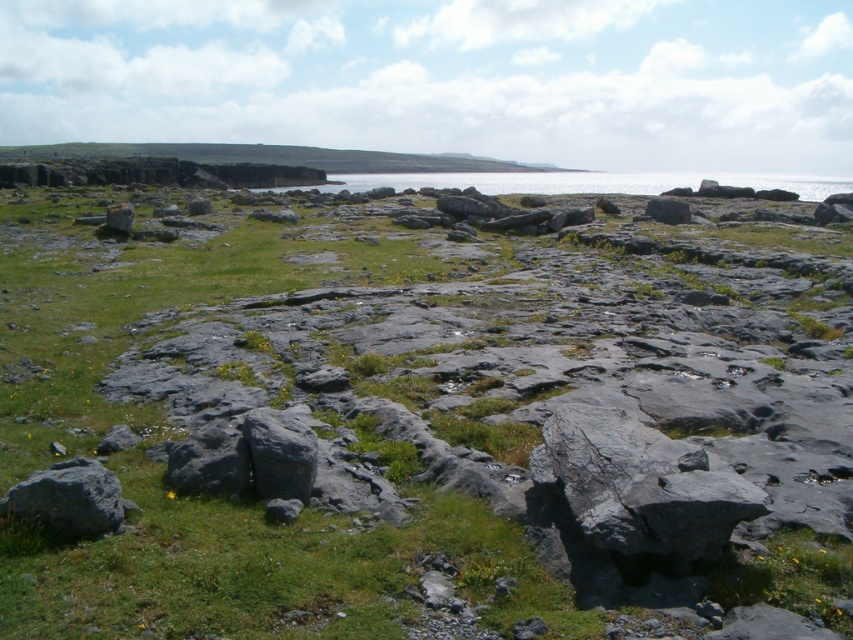
You are a drone operator trying to capture a photo of the green grassy hillside at upper center. The drone is currently at the origin point of the scene. What are the coordinates you should input to move the drone to the correct location?

The coordinates to move the drone to the green grassy hillside at upper center are point [277,156].

You are standing at the edge of the coastal landscape and want to place a small flag between the gray rough rock at lower left and the gray rough rock at center. Based on their positions, which rock should you place the flag closer to in order to ensure it is visible from your current position?

The gray rough rock at lower left is closer to the viewer, so placing the flag closer to it will ensure visibility from your current position.

You are a hiker trying to determine the best path to reach the top of the green grassy hillside at upper center. You notice the gray rough rock at lower left nearby. Which object is higher in elevation?

The green grassy hillside at upper center is taller than the gray rough rock at lower left, so the hillside has a higher elevation.